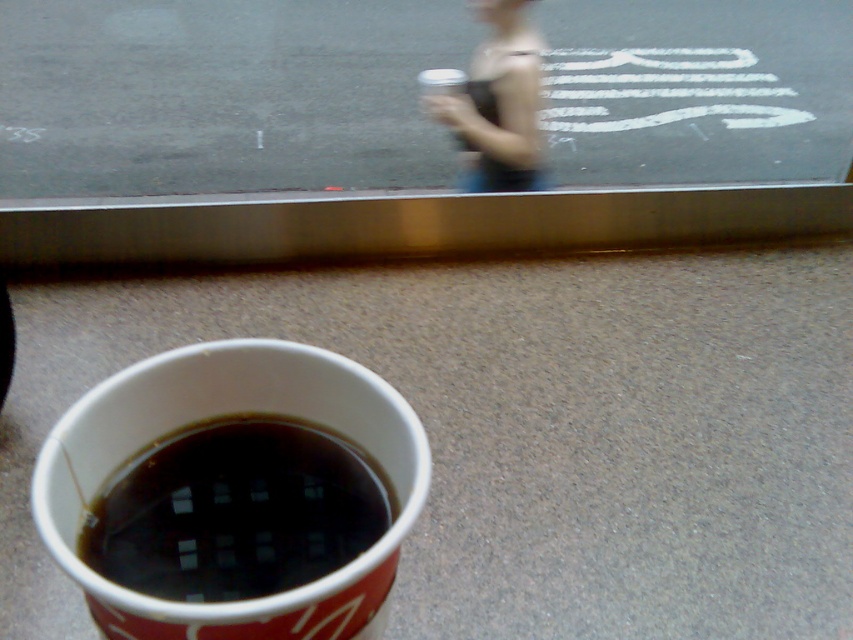
How distant is black paper cup at lower left from matte black tank top at upper center?

6.49 feet

The height and width of the screenshot is (640, 853). Identify the location of black paper cup at lower left. (235, 513).